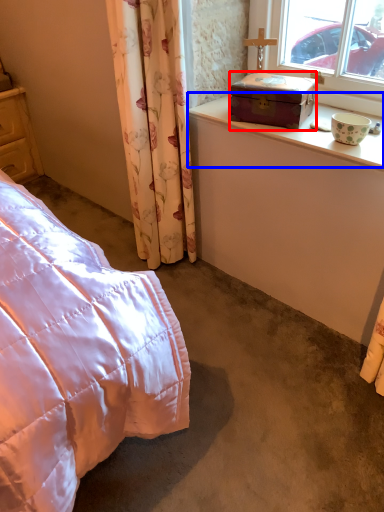
Question: Which of the following is the closest to the observer, box (highlighted by a red box) or window sill (highlighted by a blue box)?

Choices:
 (A) box
 (B) window sill

Answer: (B)